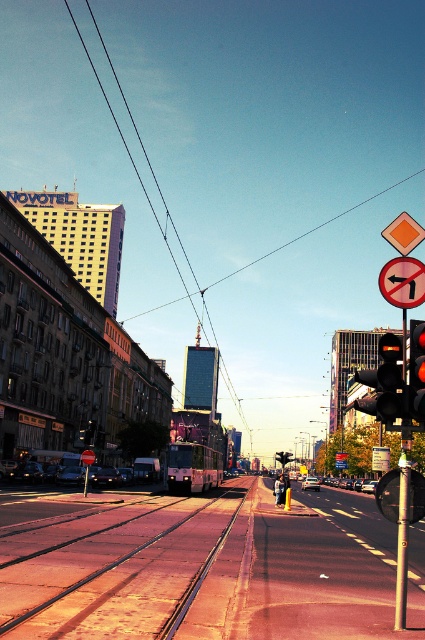
You are a delivery person trying to navigate through the street shown in the image. You need to avoid the metallic tram tracks at center to prevent damaging your delivery cart. Based on the scene description, where should you position your cart to safely avoid the tram tracks?

The metallic tram tracks at center are located at point (133,570). To safely avoid them, position your cart away from this coordinate, either to the left or right side of the tracks depending on your route.

You are a pedestrian standing on the sidewalk looking at the NOVOTEL building. You notice a metallic pole at right and a red plastic sign at upper right. Which object is closer to your left side?

The metallic pole at right is positioned on the left side of the red plastic sign at upper right, so it is closer to your left side.

You are a city planner assessing the feasibility of installing a new 5.5 meter wide pedestrian walkway between the metallic tram tracks at center. Based on the current spacing between them, will the walkway fit comfortably?

The metallic tram tracks at center are 5.36 meters apart. Since the proposed pedestrian walkway is 5.5 meters wide, it is slightly wider than the available space between the tracks. Therefore, the walkway will not fit comfortably between the metallic tram tracks at center.